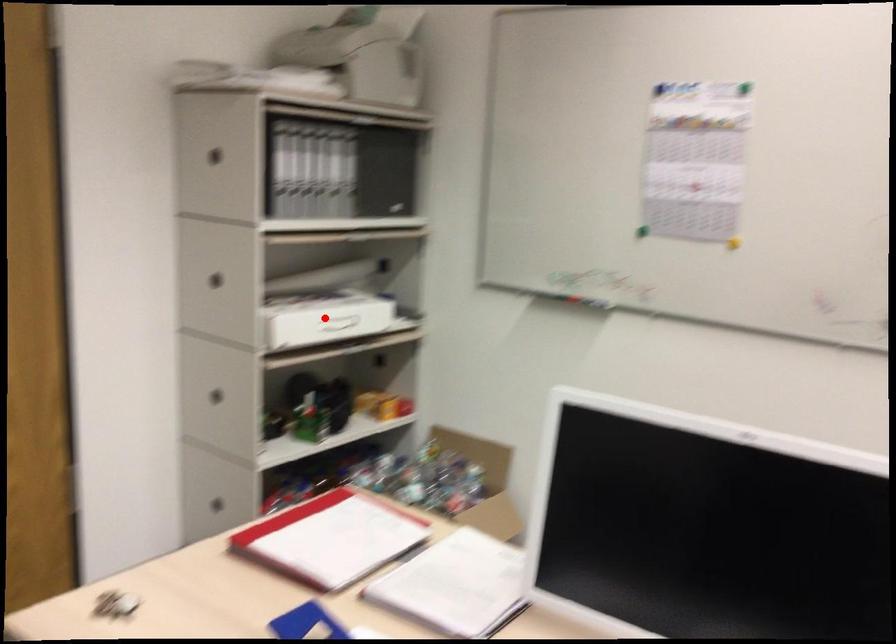
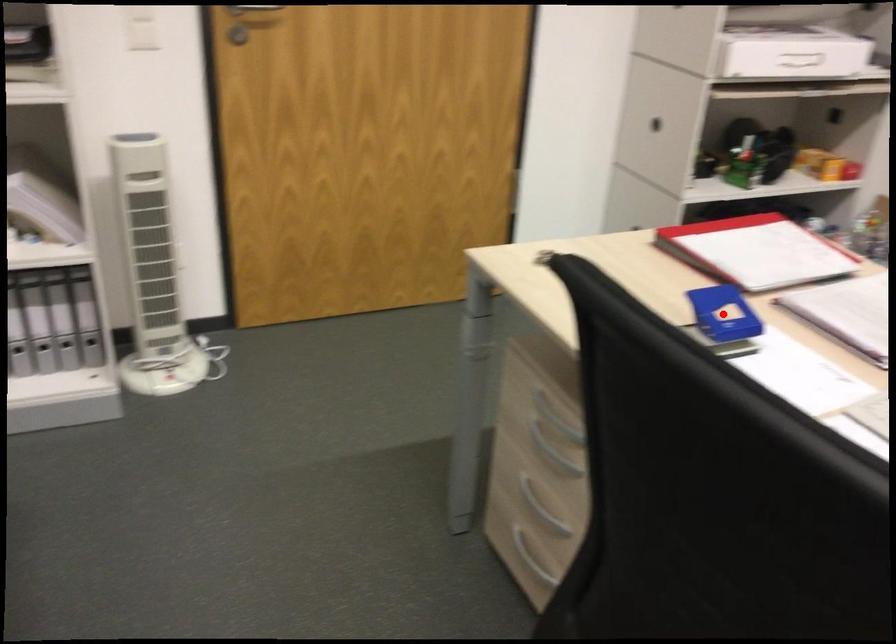
I am providing you with two images of the same scene from different viewpoints. A red point is marked on the first image and another point is marked on the second image. Is the red point in image1 aligned with the point shown in image2?

No